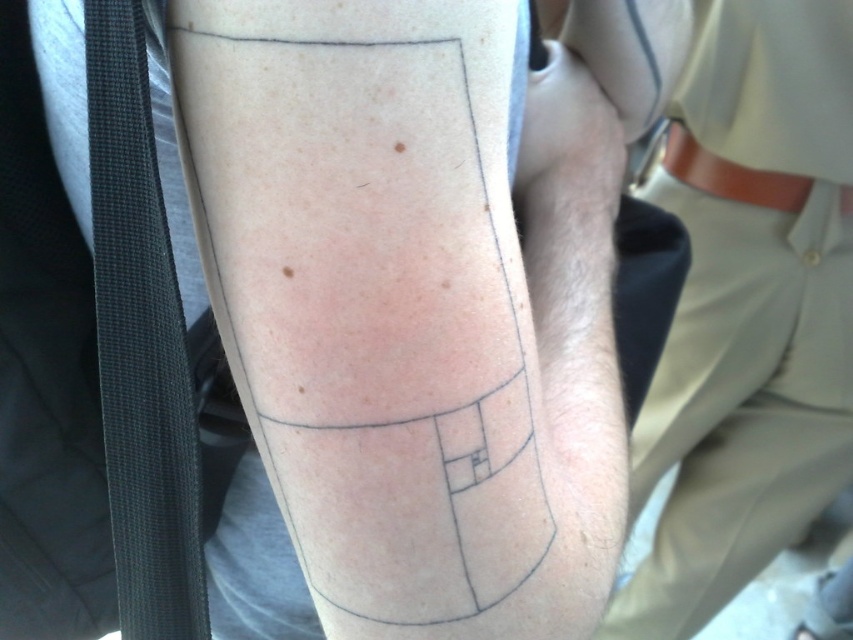
You are a tattoo artist assessing the placement of the black ink tattoo at center and the beige fabric pants at lower right on a client. Based on their positions, which object is taller?

The beige fabric pants at lower right are taller than the black ink tattoo at center.

You are a tattoo artist assessing the placement of the black ink tattoo at center and the beige fabric pants at lower right. The client wants to ensure there is enough space between them for future modifications. Given the current distance, can you confirm if they are at least 28 inches apart?

The black ink tattoo at center and beige fabric pants at lower right are 28.25 inches apart, which meets the minimum requirement of 28 inches, so there is sufficient space for future modifications.

You are a tattoo artist assessing the visibility of tattoos on a client. You notice the black ink tattoo at center and the beige fabric pants at lower right. Which object has a narrower width?

The black ink tattoo at center is thinner than beige fabric pants at lower right, so the black ink tattoo at center has a narrower width.